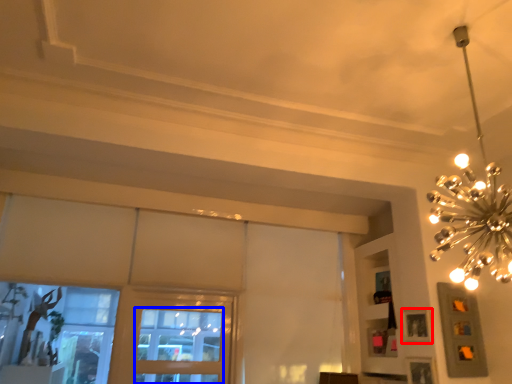
Question: Which of the following is the farthest to the observer, picture frame (highlighted by a red box) or window (highlighted by a blue box)?

Choices:
 (A) picture frame
 (B) window

Answer: (B)